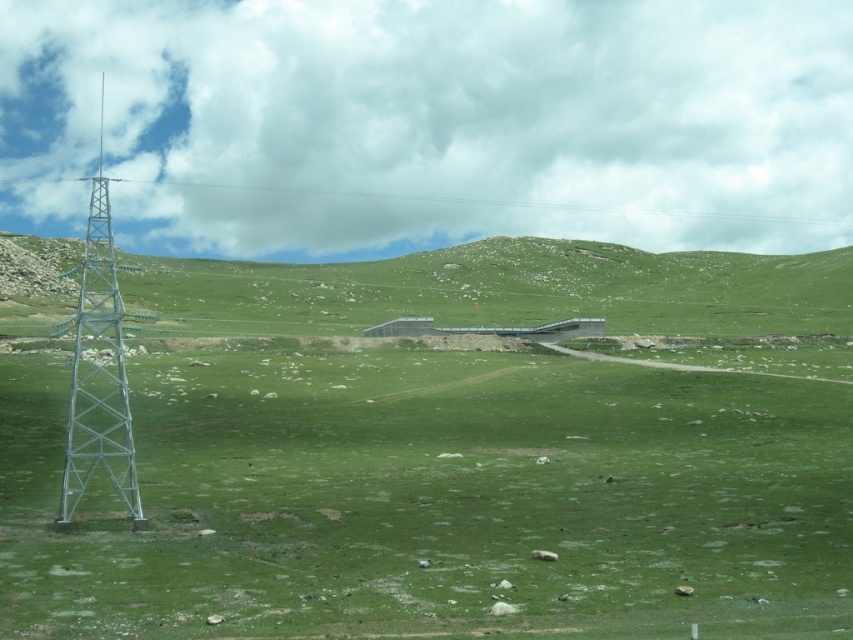
Question: Considering the real-world distances, which object is farthest from the metallic silver tower at left?

Choices:
 (A) green grassy field at center
 (B) green grassy hillside at center

Answer: (B)

Question: Which object is positioned farthest from the metallic silver tower at left?

Choices:
 (A) green grassy field at center
 (B) green grassy hillside at center

Answer: (B)

Question: From the image, what is the correct spatial relationship of green grassy field at center in relation to metallic silver tower at left?

Choices:
 (A) right
 (B) left

Answer: (A)

Question: From the image, what is the correct spatial relationship of green grassy hillside at center in relation to metallic silver tower at left?

Choices:
 (A) right
 (B) left

Answer: (A)

Question: Is green grassy field at center bigger than green grassy hillside at center?

Choices:
 (A) no
 (B) yes

Answer: (A)

Question: Which point appears closest to the camera in this image?

Choices:
 (A) (45, 307)
 (B) (111, 300)

Answer: (B)